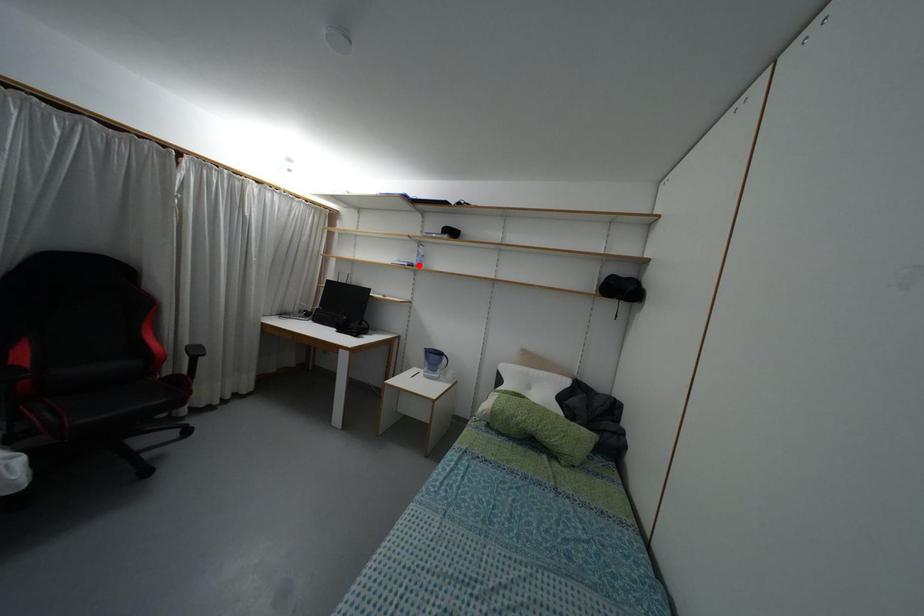
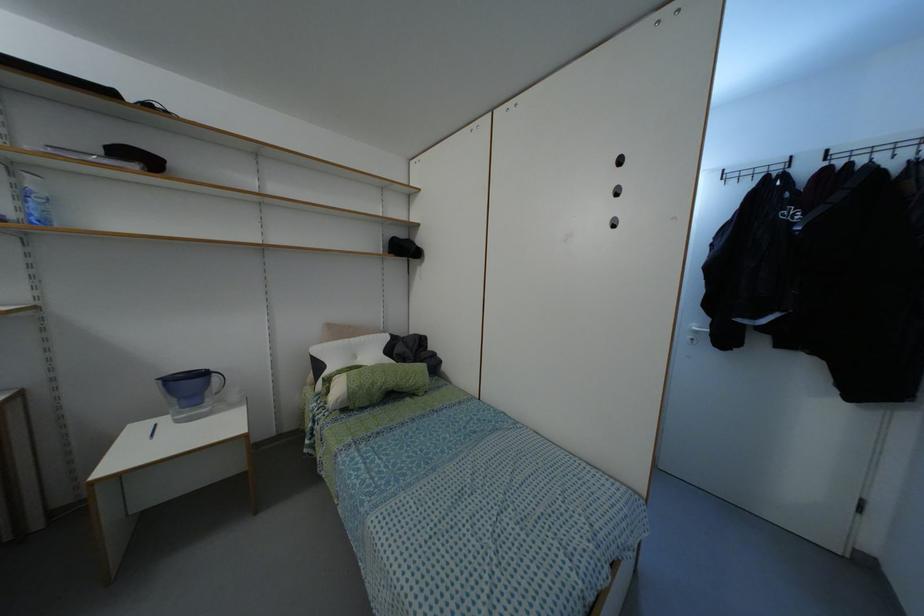
Locate, in the second image, the point that corresponds to the highlighted location in the first image.

(44, 222)